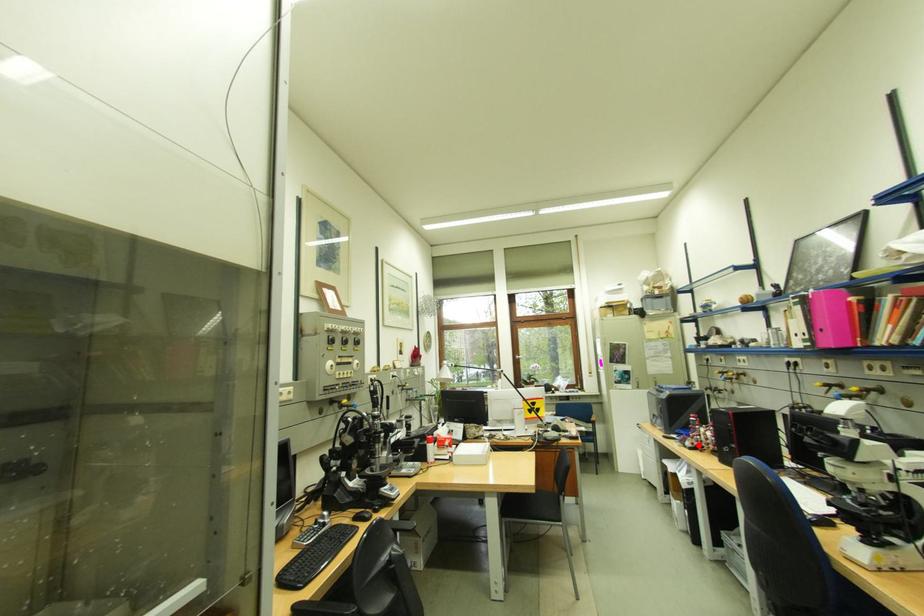
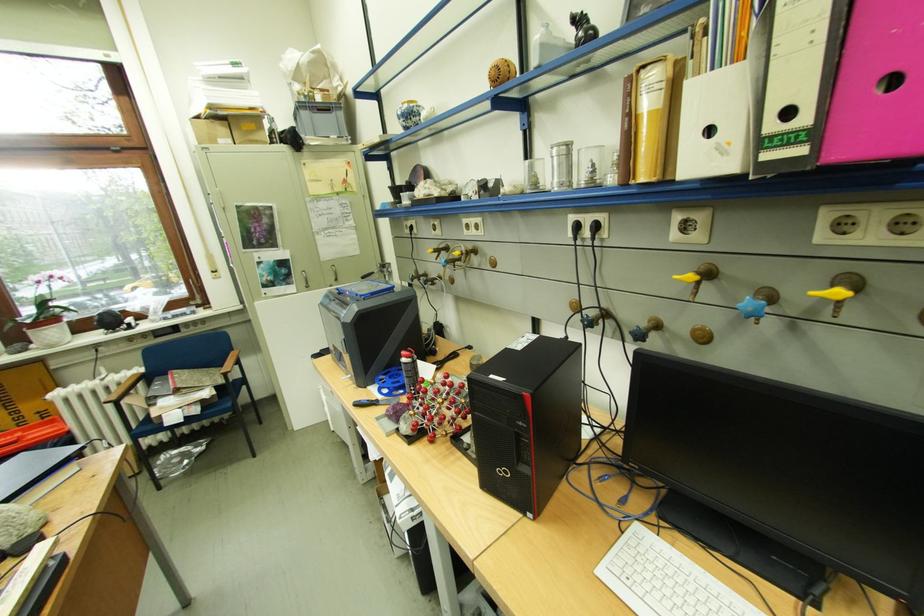
In the second image, find the point that corresponds to the highlighted location in the first image.

(415, 429)